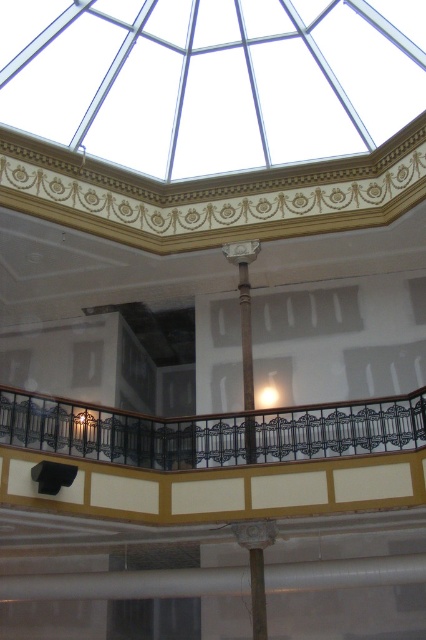
Does black wrought iron balcony at center have a greater height compared to matte gray column at center?

No.

Does black wrought iron balcony at center have a larger size compared to matte gray column at center?

Correct, black wrought iron balcony at center is larger in size than matte gray column at center.

What are the coordinates of `black wrought iron balcony at center` in the screenshot? It's located at (212, 432).